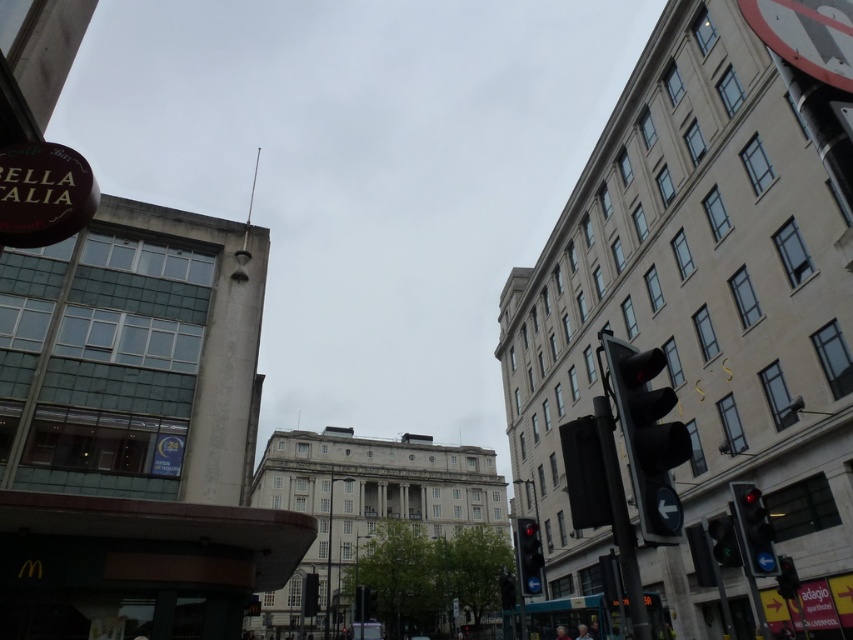
Question: Does metallic pole at right have a larger size compared to red glass traffic light at center?

Choices:
 (A) no
 (B) yes

Answer: (B)

Question: Can you confirm if black plastic traffic light at right is wider than red glass traffic light at center?

Choices:
 (A) yes
 (B) no

Answer: (A)

Question: Is metallic pole at right further to the viewer compared to red glass traffic light at center?

Choices:
 (A) yes
 (B) no

Answer: (B)

Question: Among these objects, which one is nearest to the camera?

Choices:
 (A) black plastic traffic light at right
 (B) red glass traffic light at center
 (C) metallic pole at right

Answer: (C)

Question: Which of the following is the farthest from the observer?

Choices:
 (A) red glass traffic light at right
 (B) red glass traffic light at center
 (C) black plastic traffic light at right

Answer: (B)

Question: Which point appears farthest from the camera in this image?

Choices:
 (A) (x=648, y=472)
 (B) (x=537, y=554)
 (C) (x=618, y=472)
 (D) (x=744, y=499)

Answer: (B)